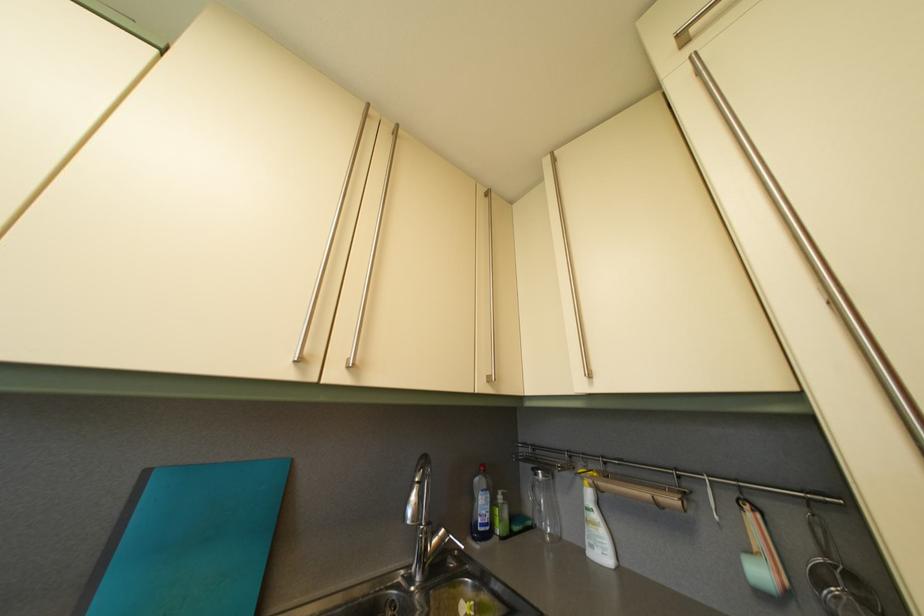
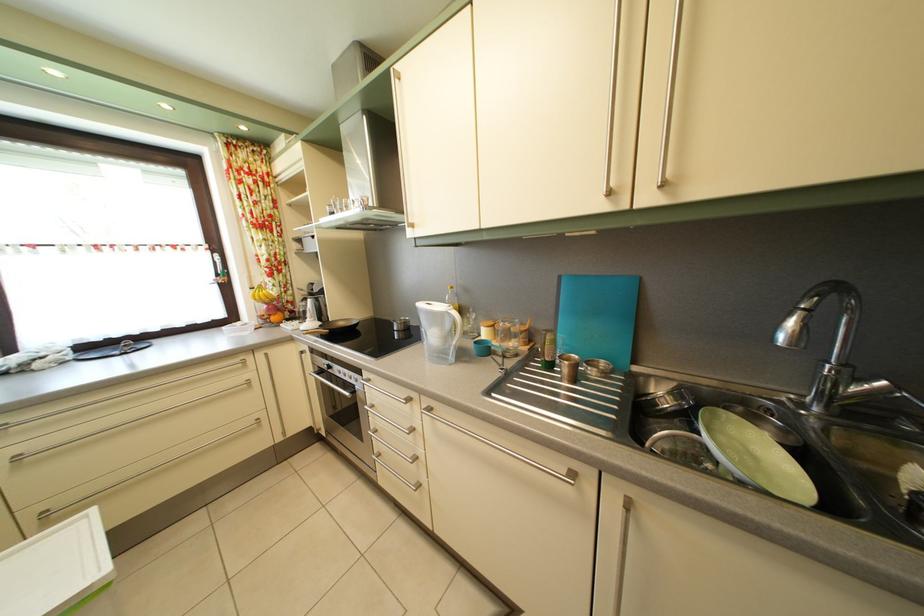
The point at (451, 539) is marked in the first image. Where is the corresponding point in the second image?

(893, 391)